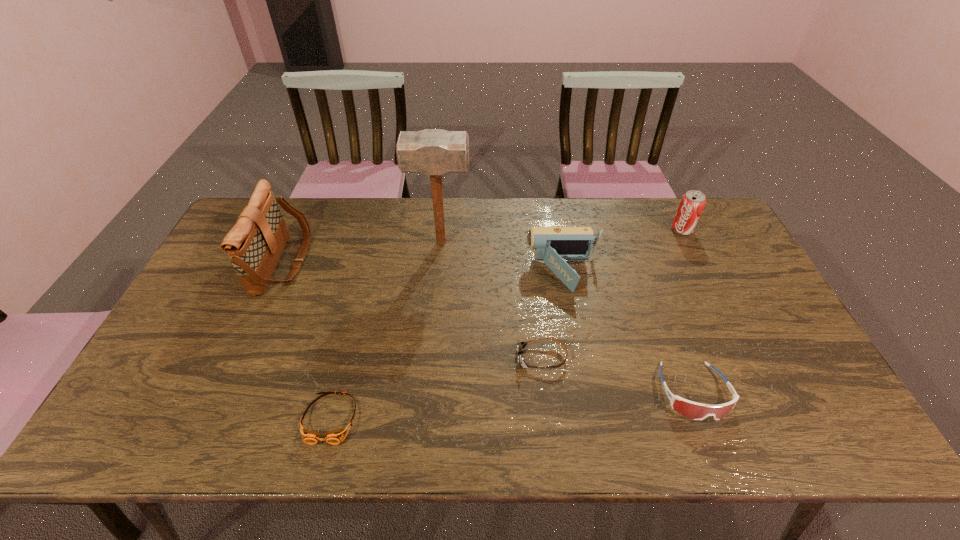
Select which object appears as the third closest to the tallest goggles. Please provide its 2D coordinates. Your answer should be formatted as a tuple, i.e. [(x, y)], where the tuple contains the x and y coordinates of a point satisfying the conditions above.

[(692, 203)]

Locate an element on the screen. This screenshot has height=540, width=960. the sixth closest object to the sixth shortest object is located at coordinates (692, 203).

This screenshot has height=540, width=960. What are the coordinates of `goggles that is the third closest to the soda can` in the screenshot? It's located at (334, 437).

I want to click on goggles object that ranks as the third closest to the leftmost object, so click(x=697, y=411).

Locate an element on the screen. The height and width of the screenshot is (540, 960). free space that satisfies the following two spatial constraints: 1. on the striking face of the third object from left to right; 2. with the lenses facing forward on the leftmost goggles is located at coordinates (425, 418).

The height and width of the screenshot is (540, 960). Identify the location of vacant region that satisfies the following two spatial constraints: 1. on the striking face of the tallest object; 2. with the lenses facing forward on the leftmost goggles. (425, 418).

You are a GUI agent. You are given a task and a screenshot of the screen. Output one action in this format:
    pyautogui.click(x=<x>, y=<y>)
    Task: Click on the free location that satisfies the following two spatial constraints: 1. on the front-facing side of the second goggles from left to right; 2. with the lenses facing forward on the sixth object from right to left
    This screenshot has height=540, width=960.
    Given the screenshot: What is the action you would take?
    pyautogui.click(x=549, y=418)

Find the location of a particular element. vacant point that satisfies the following two spatial constraints: 1. on the front-facing side of the second goggles from left to right; 2. with the lenses facing forward on the leftmost goggles is located at coordinates (549, 418).